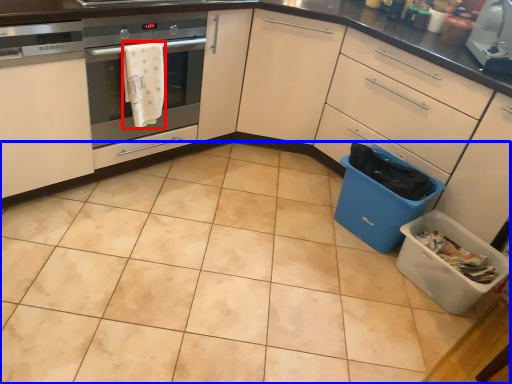
Question: Which object is further to the camera taking this photo, material (highlighted by a red box) or ceramic tile (highlighted by a blue box)?

Choices:
 (A) material
 (B) ceramic tile

Answer: (A)